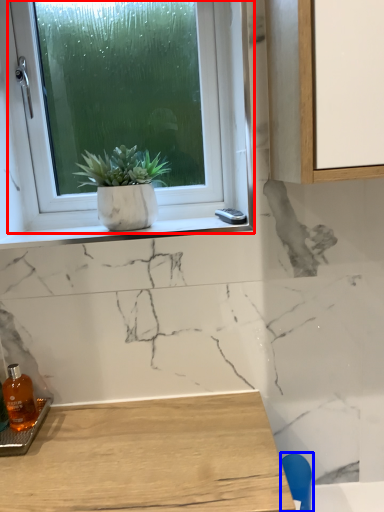
Question: Which of the following is the closest to the observer, window (highlighted by a red box) or chair (highlighted by a blue box)?

Choices:
 (A) window
 (B) chair

Answer: (B)